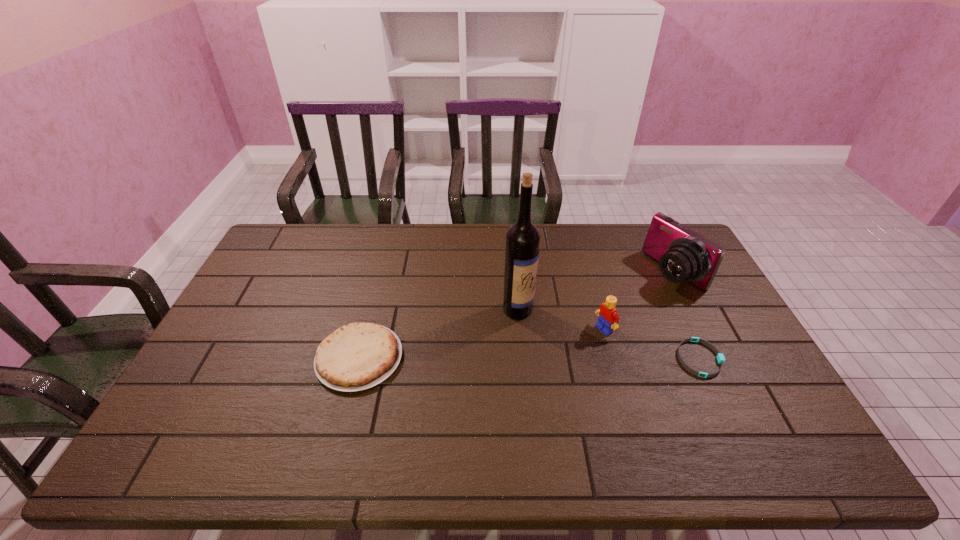
Identify the location of vacant area situated on the buckle of the shortest object. The image size is (960, 540). (752, 359).

This screenshot has height=540, width=960. I want to click on vacant space located 0.330m on the face of the Lego, so click(503, 383).

At what (x,y) coordinates should I click in order to perform the action: click on free space located 0.300m on the face of the Lego. Please return your answer as a coordinate pair (x, y). Image resolution: width=960 pixels, height=540 pixels. Looking at the image, I should click on (513, 379).

In order to click on vacant space positioned on the face of the Lego in this screenshot , I will do `click(545, 361)`.

Find the location of `vacant space situated on the front-facing side of the camera`. vacant space situated on the front-facing side of the camera is located at coordinates (623, 307).

I want to click on free space located 0.330m on the front-facing side of the camera, so click(x=586, y=328).

Locate an element on the screen. The height and width of the screenshot is (540, 960). vacant region located 0.120m on the front-facing side of the camera is located at coordinates (635, 301).

The image size is (960, 540). Find the location of `free space located 0.200m on the label of the tallest object`. free space located 0.200m on the label of the tallest object is located at coordinates [x=577, y=360].

What are the coordinates of `vacant space located 0.190m on the label of the tallest object` in the screenshot? It's located at (574, 358).

Locate an element on the screen. free space located 0.210m on the label of the tallest object is located at coordinates (579, 362).